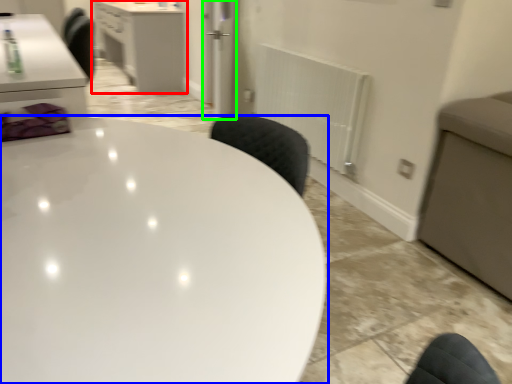
Question: Based on their relative distances, which object is nearer to cabinetry (highlighted by a red box)? Choose from table (highlighted by a blue box) and glass door (highlighted by a green box).

Choices:
 (A) table
 (B) glass door

Answer: (B)